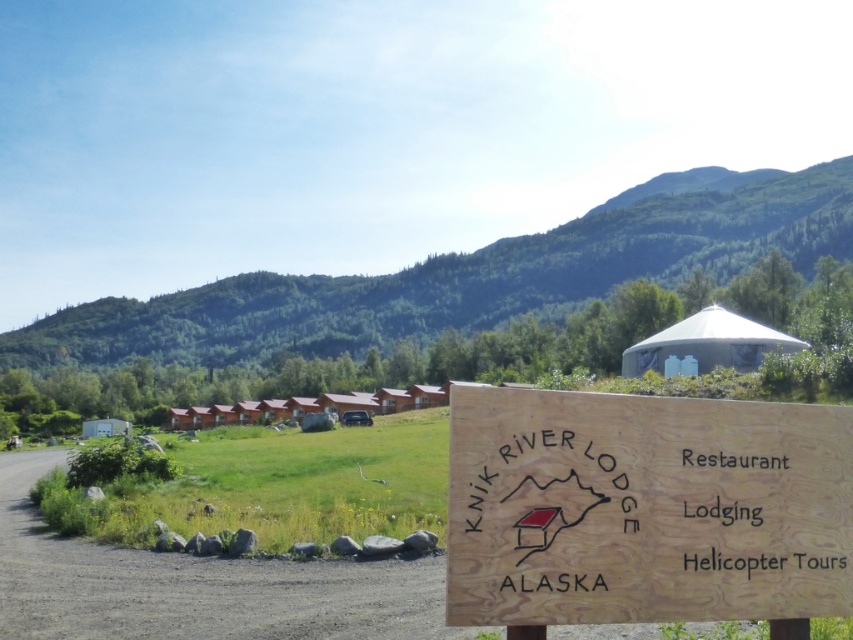
Question: Is wooden sign at center closer to camera compared to green forested mountain at upper center?

Choices:
 (A) no
 (B) yes

Answer: (B)

Question: Does wooden sign at center have a lesser width compared to green forested mountain at upper center?

Choices:
 (A) no
 (B) yes

Answer: (B)

Question: Which point appears farthest from the camera in this image?

Choices:
 (A) (577, 268)
 (B) (694, 588)

Answer: (A)

Question: Is wooden sign at center further to the viewer compared to green forested mountain at upper center?

Choices:
 (A) yes
 (B) no

Answer: (B)

Question: Among these points, which one is nearest to the camera?

Choices:
 (A) (41, 349)
 (B) (543, 429)

Answer: (B)